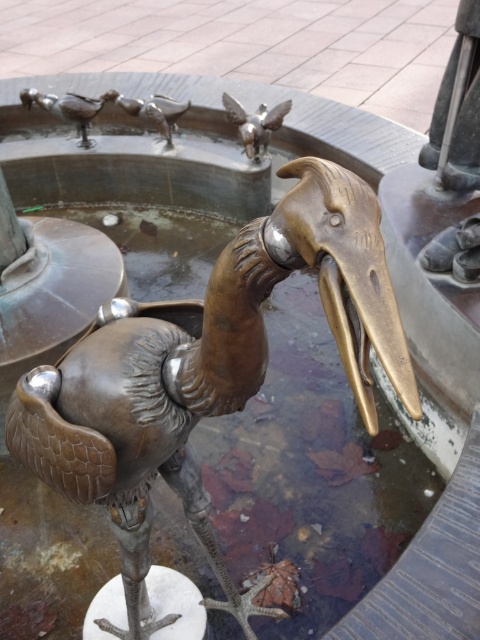
Measure the distance from polished silver bird at center to shiny silver birds at upper center.

They are 17.00 inches apart.

Which is in front, point (264, 136) or point (163, 125)?

Point (264, 136) is more forward.

You are a GUI agent. You are given a task and a screenshot of the screen. Output one action in this format:
    pyautogui.click(x=<x>, y=<y>)
    Task: Click on the polished silver bird at center
    
    Given the screenshot: What is the action you would take?
    pyautogui.click(x=254, y=124)

Is bronze statue at center above shiny silver birds at upper center?

No.

Is bronze statue at center to the right of shiny silver birds at upper center from the viewer's perspective?

Yes, bronze statue at center is to the right of shiny silver birds at upper center.

Is point (168, 410) farther from camera compared to point (166, 129)?

No, (168, 410) is in front of (166, 129).

This screenshot has width=480, height=640. What are the coordinates of `bronze statue at center` in the screenshot? It's located at (206, 372).

Is polished silver bird at center below shiny silver birds at upper left?

Yes.

Which is above, polished silver bird at center or shiny silver birds at upper left?

shiny silver birds at upper left is higher up.

Locate an element on the screen. Image resolution: width=480 pixels, height=640 pixels. polished silver bird at center is located at coordinates (254, 124).

At what (x,y) coordinates should I click in order to perform the action: click on polished silver bird at center. Please return your answer as a coordinate pair (x, y). This screenshot has width=480, height=640. Looking at the image, I should click on (254, 124).